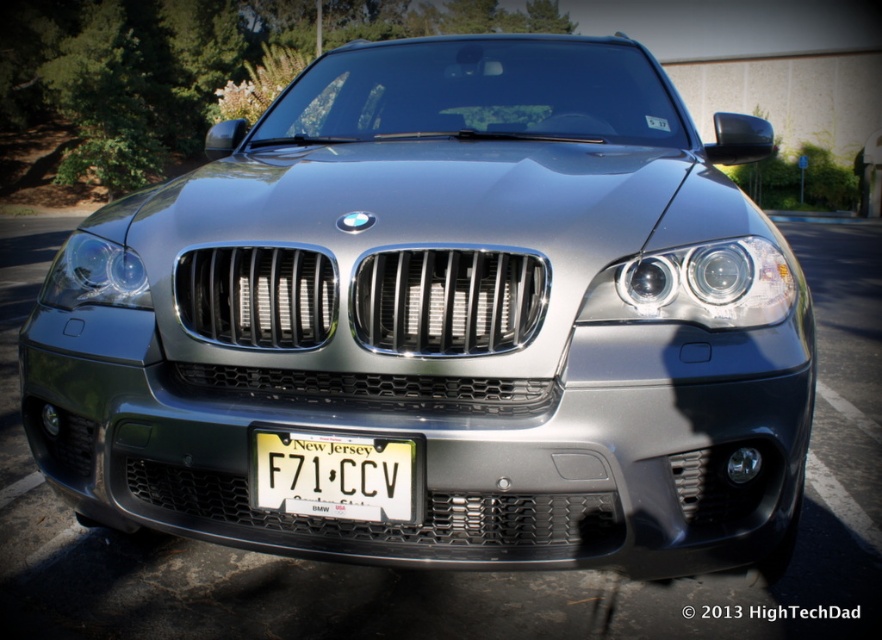
Question: Is satin chrome headlight at center below clear plastic headlight at left?

Choices:
 (A) yes
 (B) no

Answer: (A)

Question: Where is white plastic license plate at center located in relation to satin chrome headlight at center in the image?

Choices:
 (A) below
 (B) above

Answer: (A)

Question: Can you confirm if white plastic license plate at center is positioned below satin chrome headlight at center?

Choices:
 (A) yes
 (B) no

Answer: (A)

Question: Which point is farther from the camera taking this photo?

Choices:
 (A) (656, 308)
 (B) (274, 438)

Answer: (A)

Question: Which object is farther from the camera taking this photo?

Choices:
 (A) clear plastic headlight at left
 (B) white plastic license plate at center
 (C) satin chrome headlight at center

Answer: (C)

Question: Estimate the real-world distances between objects in this image. Which object is farther from the white plastic license plate at center?

Choices:
 (A) satin chrome headlight at center
 (B) clear plastic headlight at left

Answer: (A)